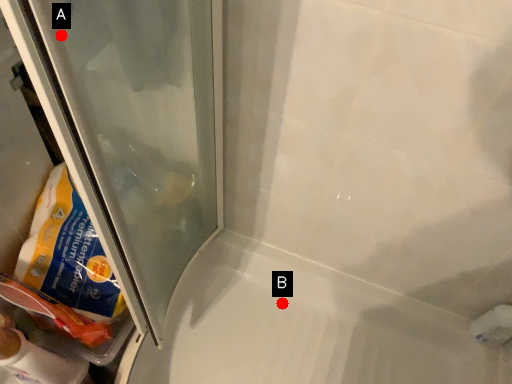
Question: Two points are circled on the image, labeled by A and B beside each circle. Which point is closer to the camera?

Choices:
 (A) A is closer
 (B) B is closer

Answer: (A)